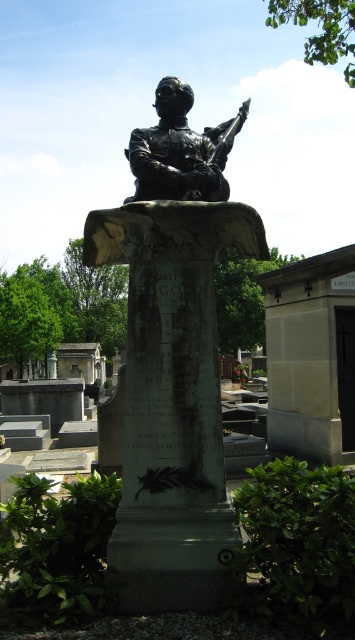
Consider the image. You are a visitor at the cemetery and want to take a photo of both the black polished statue at center and the bronze statue at center. Which statue should you position closer to the camera to ensure both are fully visible in the frame?

You should position the black polished statue at center closer to the camera because it might be wider than the bronze statue at center, ensuring both fit within the frame.

You are a visitor at the cemetery and want to take a photo of the black polished statue at center and the bronze statue at center. Which statue should you focus on first if you want to capture both in a single frame without moving your camera?

The black polished statue at center is taller than the bronze statue at center, so you should focus on the bronze statue at center first to ensure both fit in the frame.